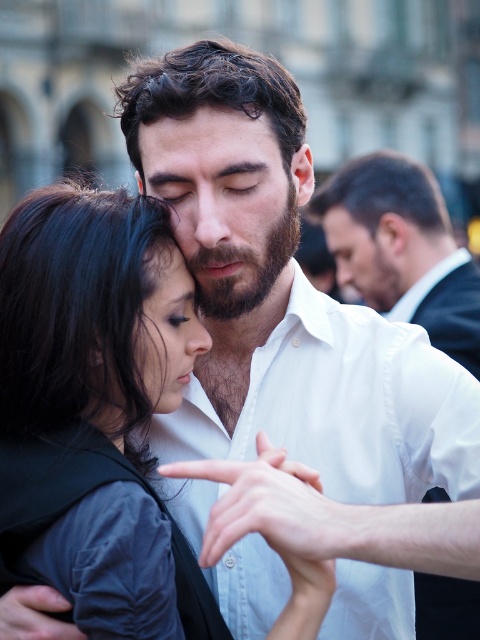
You are a photographer trying to capture a closeup of the smooth black hair at center and the white smooth shirt at center. Which object should you focus on first to ensure both are in focus?

The smooth black hair at center is closer to the viewer than the white smooth shirt at center. To ensure both are in focus, focus on the smooth black hair at center first since it is closer, and the depth of field will extend to the shirt behind it.

You are a photographer who wants to capture the couple in the image. The smooth black hair at center and the dark brown hair at center are both in the frame. Which hair is larger in size?

The smooth black hair at center is bigger than the dark brown hair at center, so the smooth black hair at center is larger in size.